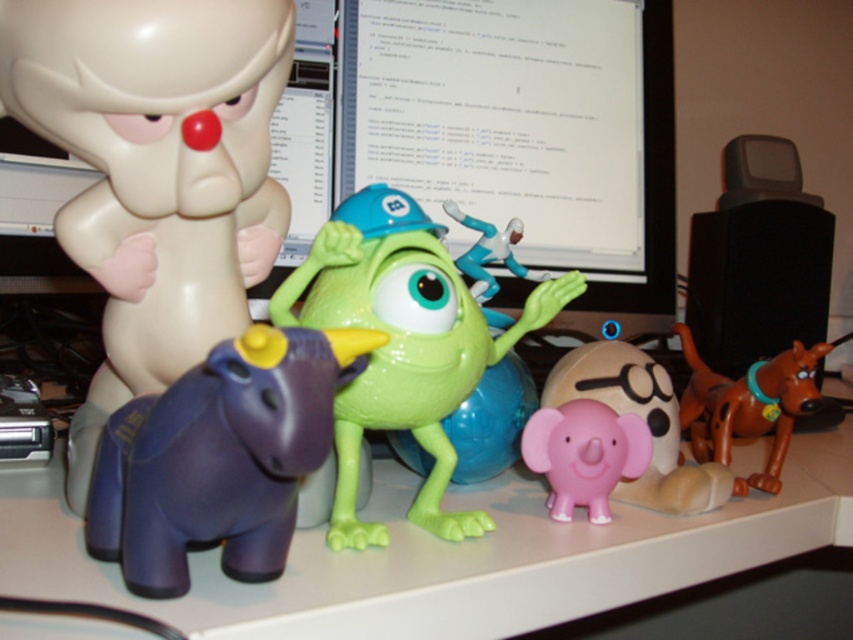
You are a robot trying to navigate to a specific point. You are currently at point (259, 540). The target point is (561, 509). Will you need to move forward or backward to reach the target point?

Point (259, 540) is in front of point (561, 509). Therefore, to reach the target point, you will need to move backward.

You are a delivery robot with a height of 30 centimeters. You need to pick up the purple matte elephant at lower left from the desk. Can you reach it without knocking over any other objects?

The purple matte elephant at lower left is 26.80 centimeters away from the viewer. Since the robot is 30 centimeters tall, it can reach the elephant as it is within its height range. However, the question mentions not knocking over other objects, but the scene description does not provide information about the proximity or stability of other items. Therefore, based on the given data, the robot can reach it, but potential risks with other objects cannot be assessed.